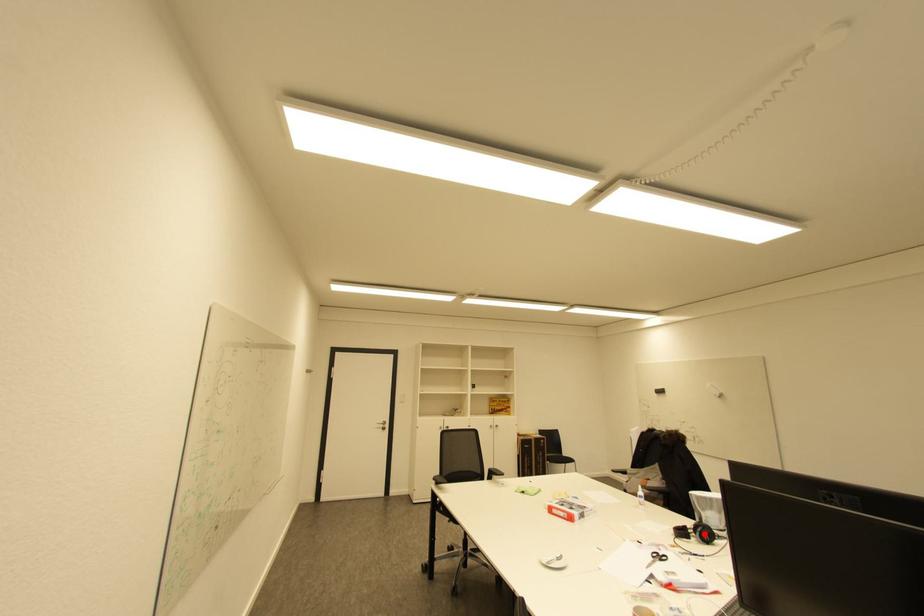
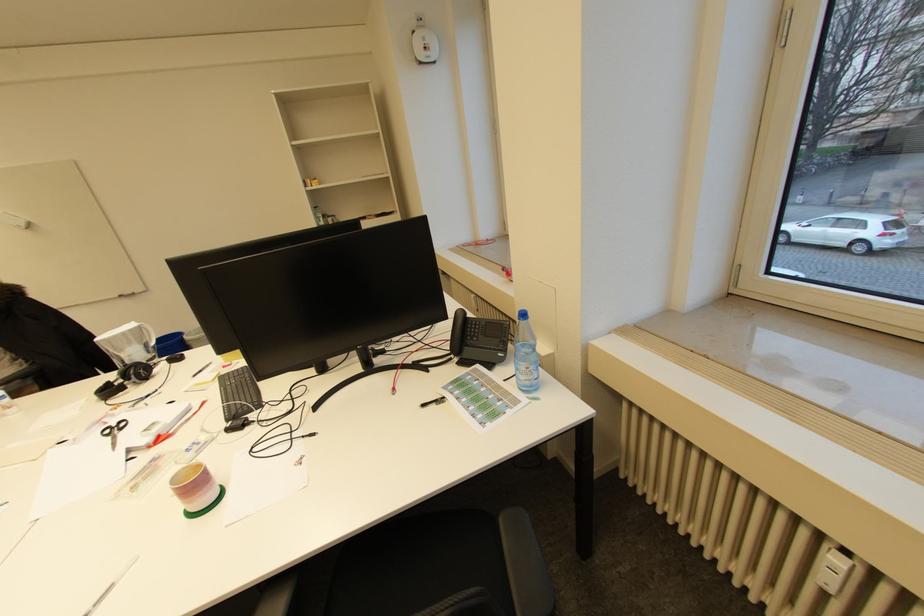
Question: I am providing you with two images of the same scene from different viewpoints. A red point is marked on the first image. Is the red point's position out of view in image 2?

Choices:
 (A) Yes
 (B) No

Answer: (B)